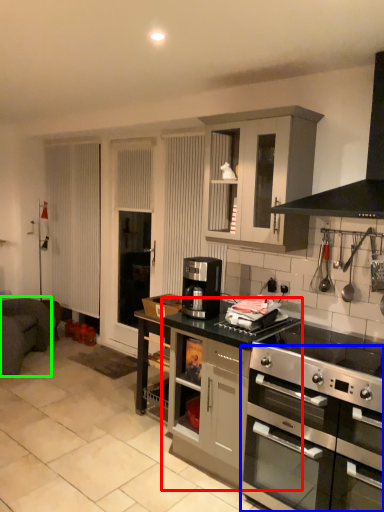
Question: Which is farther away from cabinetry (highlighted by a red box)? oven (highlighted by a blue box) or armchair (highlighted by a green box)?

Choices:
 (A) oven
 (B) armchair

Answer: (B)